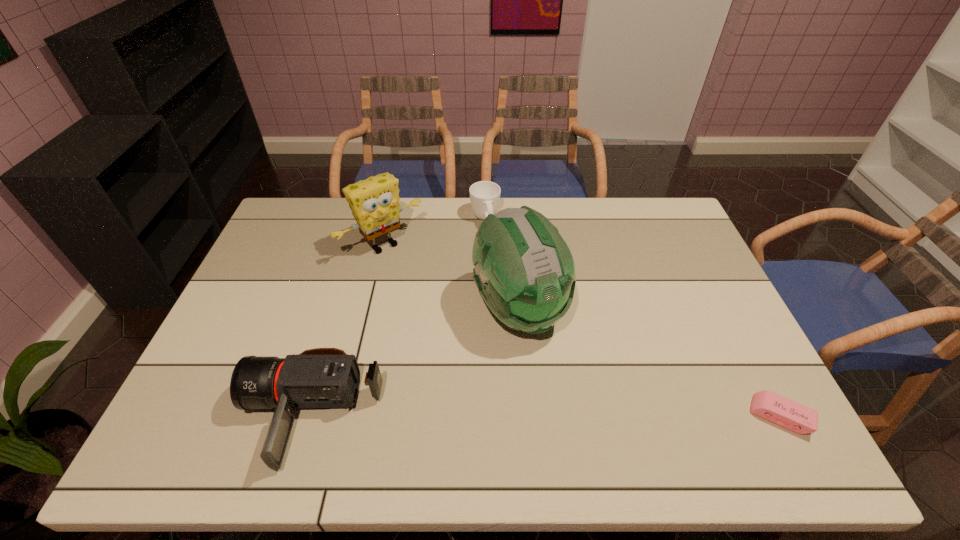
Locate an element on the screen. camcorder that is positioned at the near edge is located at coordinates (322, 377).

Image resolution: width=960 pixels, height=540 pixels. What are the coordinates of `eraser that is at the near edge` in the screenshot? It's located at (768, 405).

Identify the location of object situated at the left edge. The image size is (960, 540). (322, 377).

At what (x,y) coordinates should I click in order to perform the action: click on object present at the right edge. Please return your answer as a coordinate pair (x, y). The height and width of the screenshot is (540, 960). Looking at the image, I should click on (768, 405).

At what (x,y) coordinates should I click in order to perform the action: click on object located in the near left corner section of the desktop. Please return your answer as a coordinate pair (x, y). This screenshot has width=960, height=540. Looking at the image, I should click on (322, 377).

This screenshot has height=540, width=960. Identify the location of object located in the near right corner section of the desktop. (768, 405).

In the image, there is a desktop. Identify the location of blank space at the far edge. (429, 199).

This screenshot has height=540, width=960. What are the coordinates of `free point at the left edge` in the screenshot? It's located at (265, 260).

In the image, there is a desktop. Identify the location of blank space at the right edge. This screenshot has height=540, width=960. (698, 259).

Where is `blank space at the far left corner of the desktop`? Image resolution: width=960 pixels, height=540 pixels. blank space at the far left corner of the desktop is located at coordinates (311, 221).